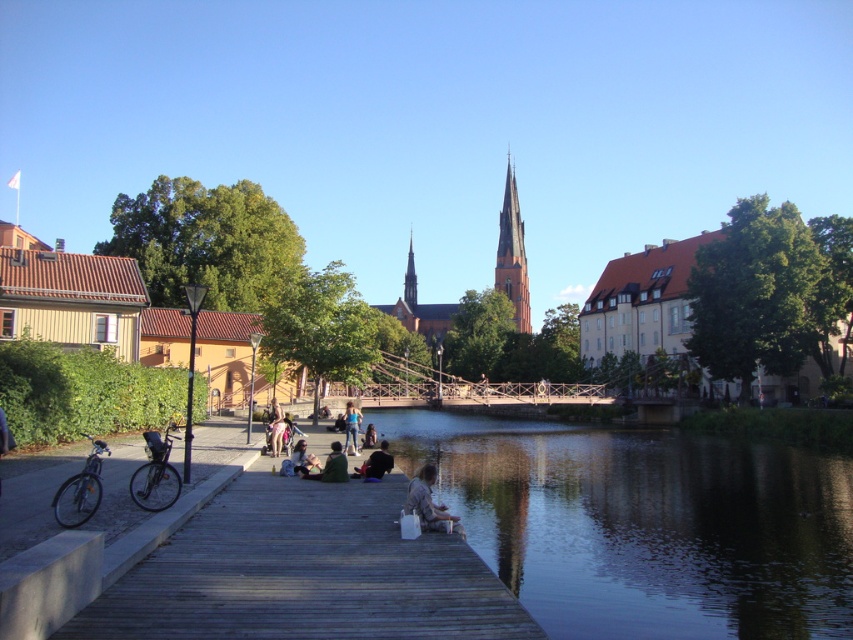
Question: Is red brick spire at center positioned behind green fabric jacket at center?

Choices:
 (A) yes
 (B) no

Answer: (A)

Question: Does wooden dock at center appear on the left side of green fabric jacket at center?

Choices:
 (A) yes
 (B) no

Answer: (B)

Question: Does red brick spire at center have a smaller size compared to light brown wooden dock at center?

Choices:
 (A) yes
 (B) no

Answer: (B)

Question: Which point is farther to the camera?

Choices:
 (A) green fabric jacket at center
 (B) light brown wooden bench at lower center
 (C) wooden dock at lower center
 (D) red brick spire at center

Answer: (D)

Question: Which object is closer to the camera taking this photo?

Choices:
 (A) wooden dock at center
 (B) wooden dock at lower center

Answer: (A)

Question: Which of the following is the closest to the observer?

Choices:
 (A) (347, 433)
 (B) (662, 464)
 (C) (283, 465)
 (D) (508, 259)

Answer: (C)